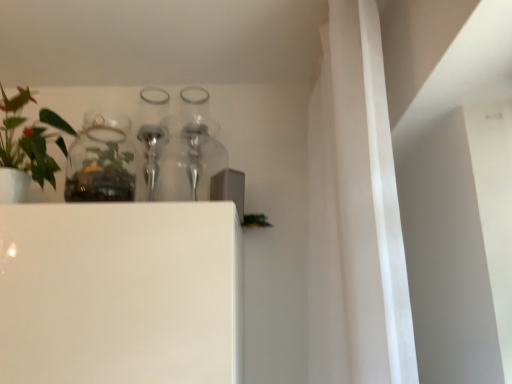
What do you see at coordinates (101, 161) in the screenshot? This screenshot has height=384, width=512. I see `clear glass jar at upper left` at bounding box center [101, 161].

Locate an element on the screen. clear glass bottle at upper center is located at coordinates (152, 129).

What do you see at coordinates (24, 149) in the screenshot?
I see `green matte plant at left` at bounding box center [24, 149].

At what (x,y) coordinates should I click in order to perform the action: click on clear glass jar at upper left. Please return your answer as a coordinate pair (x, y). Looking at the image, I should click on (101, 161).

Is point (4, 152) behind point (163, 103)?

No, (4, 152) is in front of (163, 103).

Is green matte plant at left taller than clear glass bottle at upper center?

No.

Is green matte plant at left positioned with its back to clear glass bottle at upper center?

No, green matte plant at left is not facing the opposite direction of clear glass bottle at upper center.

Is green matte plant at left far away from clear glass jar at upper left?

No, green matte plant at left is in close proximity to clear glass jar at upper left.

From a real-world perspective, is green matte plant at left over clear glass jar at upper left?

Indeed, from a real-world perspective, green matte plant at left stands above clear glass jar at upper left.

Is green matte plant at left wider or thinner than clear glass jar at upper left?

Clearly, green matte plant at left has more width compared to clear glass jar at upper left.

In terms of width, does clear glass jar at upper left look wider or thinner when compared to green matte plant at left?

clear glass jar at upper left is thinner than green matte plant at left.

From a real-world perspective, is clear glass jar at upper left on green matte plant at left?

No, from a real-world perspective, clear glass jar at upper left is not over green matte plant at left

Is clear glass jar at upper left positioned beyond the bounds of green matte plant at left?

Yes, clear glass jar at upper left is not within green matte plant at left.

Which is more to the left, clear glass jar at upper left or green matte plant at left?

From the viewer's perspective, green matte plant at left appears more on the left side.

Which object is further away from the camera, clear glass bottle at upper center or clear glass jar at upper left?

clear glass bottle at upper center is further from the camera.

How many degrees apart are the facing directions of clear glass bottle at upper center and clear glass jar at upper left?

The angular difference between clear glass bottle at upper center and clear glass jar at upper left is 0.00067 degrees.

This screenshot has width=512, height=384. I want to click on bottle on the right of clear glass jar at upper left, so click(152, 129).

Considering the sizes of objects clear glass bottle at upper center and clear glass jar at upper left in the image provided, who is thinner, clear glass bottle at upper center or clear glass jar at upper left?

With smaller width is clear glass bottle at upper center.

Is the depth of clear glass bottle at upper center less than that of green matte plant at left?

No, it is behind green matte plant at left.

Considering the relative sizes of clear glass bottle at upper center and green matte plant at left in the image provided, is clear glass bottle at upper center taller than green matte plant at left?

Yes.

From a real-world perspective, who is located lower, clear glass bottle at upper center or green matte plant at left?

green matte plant at left is physically lower.

Would you say clear glass bottle at upper center is outside green matte plant at left?

Yes.

In order to click on glass vase directly beneath the clear glass bottle at upper center (from a real-world perspective) in this screenshot , I will do `click(101, 161)`.

In the scene shown: Would you say clear glass bottle at upper center is part of clear glass jar at upper left's contents?

Actually, clear glass bottle at upper center is outside clear glass jar at upper left.

From the image's perspective, relative to clear glass bottle at upper center, is clear glass jar at upper left above or below?

Clearly, from the image's perspective, clear glass jar at upper left is below clear glass bottle at upper center.

Does clear glass jar at upper left have a smaller size compared to clear glass bottle at upper center?

No.

Locate an element on the screen. The height and width of the screenshot is (384, 512). bottle above the green matte plant at left (from a real-world perspective) is located at coordinates tap(152, 129).

Locate an element on the screen. This screenshot has width=512, height=384. glass vase beneath the green matte plant at left (from a real-world perspective) is located at coordinates (101, 161).

When comparing their distances from clear glass jar at upper left, does clear glass bottle at upper center or green matte plant at left seem closer?

The object closer to clear glass jar at upper left is green matte plant at left.

When comparing their distances from clear glass bottle at upper center, does clear glass jar at upper left or green matte plant at left seem further?

green matte plant at left is positioned further to the anchor clear glass bottle at upper center.

Which object lies further to the anchor point clear glass jar at upper left, green matte plant at left or clear glass bottle at upper center?

clear glass bottle at upper center is further to clear glass jar at upper left.

Estimate the real-world distances between objects in this image. Which object is further from green matte plant at left, clear glass jar at upper left or clear glass bottle at upper center?

The object further to green matte plant at left is clear glass bottle at upper center.

Estimate the real-world distances between objects in this image. Which object is closer to clear glass bottle at upper center, green matte plant at left or clear glass jar at upper left?

clear glass jar at upper left is positioned closer to the anchor clear glass bottle at upper center.

Based on their spatial positions, is clear glass bottle at upper center or clear glass jar at upper left further from green matte plant at left?

Based on the image, clear glass bottle at upper center appears to be further to green matte plant at left.

Locate an element on the screen. This screenshot has height=384, width=512. glass vase between green matte plant at left and clear glass bottle at upper center is located at coordinates (101, 161).